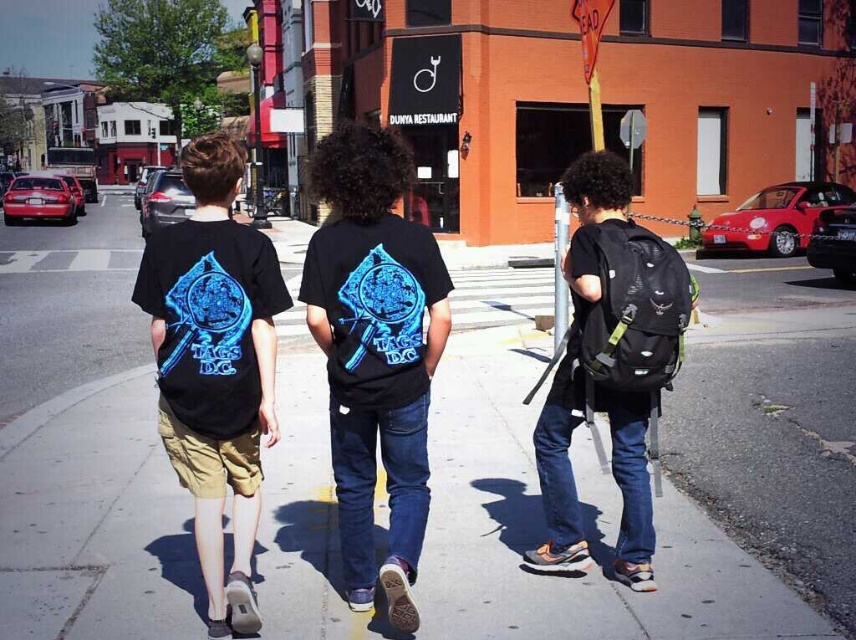
Between gray asphalt sidewalk at center and matte black t-shirt at center, which one has more height?

matte black t-shirt at center is taller.

Is gray asphalt sidewalk at center shorter than matte black t-shirt at center?

Indeed, gray asphalt sidewalk at center has a lesser height compared to matte black t-shirt at center.

What are the coordinates of `gray asphalt sidewalk at center` in the screenshot? It's located at (663, 467).

Is the position of matte black t-shirt at center more distant than that of black matte t-shirt at left?

No, matte black t-shirt at center is closer to the viewer.

The width and height of the screenshot is (856, 640). What do you see at coordinates (375, 353) in the screenshot?
I see `matte black t-shirt at center` at bounding box center [375, 353].

You are a GUI agent. You are given a task and a screenshot of the screen. Output one action in this format:
    pyautogui.click(x=<x>, y=<y>)
    Task: Click on the matte black t-shirt at center
    The width and height of the screenshot is (856, 640).
    Given the screenshot: What is the action you would take?
    pyautogui.click(x=375, y=353)

Who is more forward, (140, 435) or (189, 413)?

Point (189, 413)

Is point (131, 516) positioned in front of point (218, 508)?

That is False.

At what (x,y) coordinates should I click in order to perform the action: click on gray asphalt sidewalk at center. Please return your answer as a coordinate pair (x, y). The image size is (856, 640). Looking at the image, I should click on (663, 467).